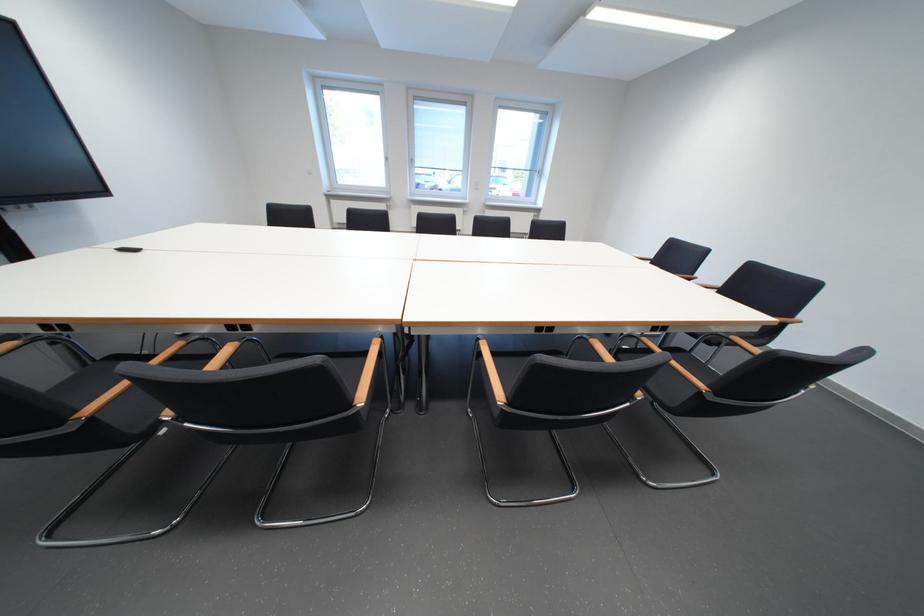
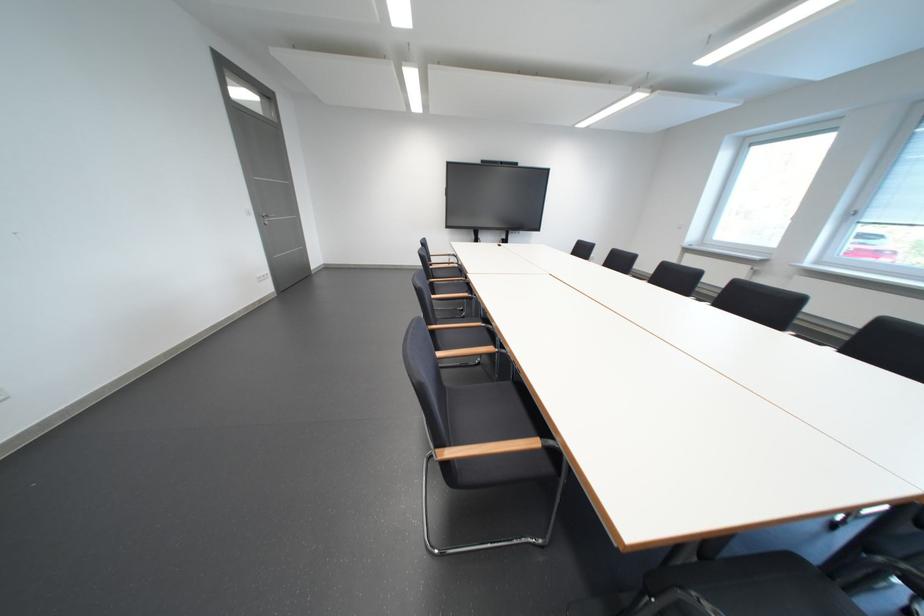
Question: I am providing you with two images of the same scene from different viewpoints. Please identify which objects are invisible in image2.

Choices:
 (A) red stamper
 (B) wooden chair armrest
 (C) silver door handle
 (D) black chair sitting surface

Answer: (B)